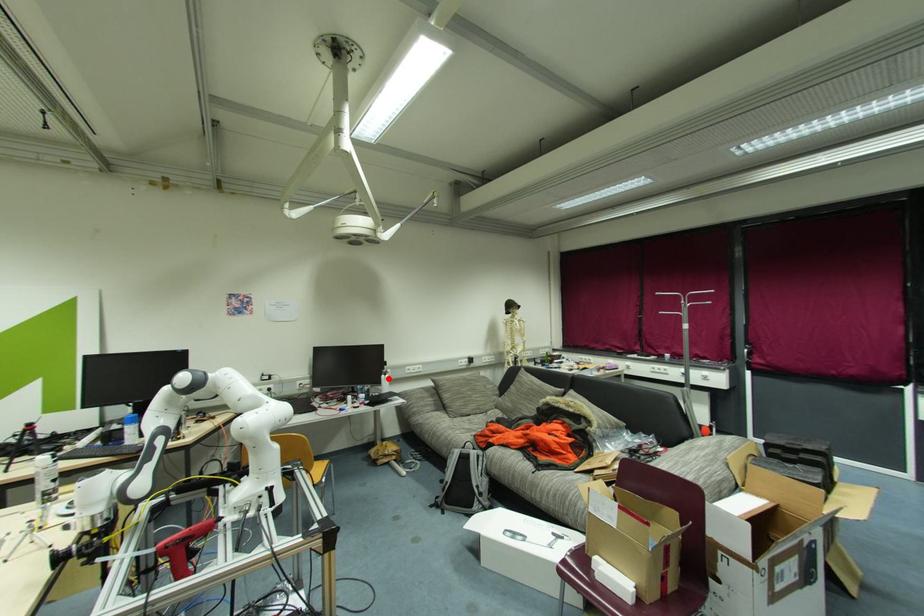
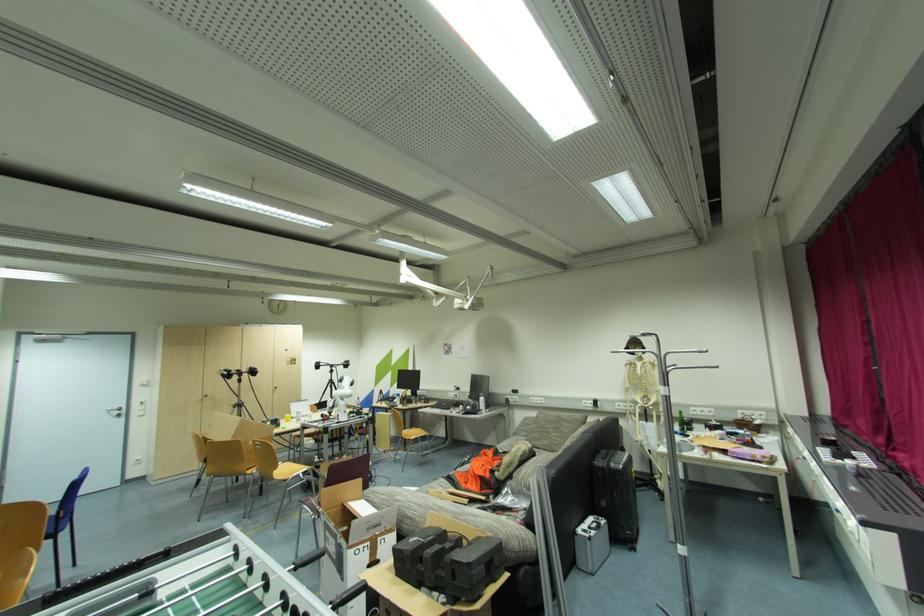
Question: I am providing you with two images of the same scene from different viewpoints. Given a red point in image1, look at the same physical point in image2. Is it:

Choices:
 (A) Closer to the viewpoint
 (B) Farther from the viewpoint

Answer: (B)